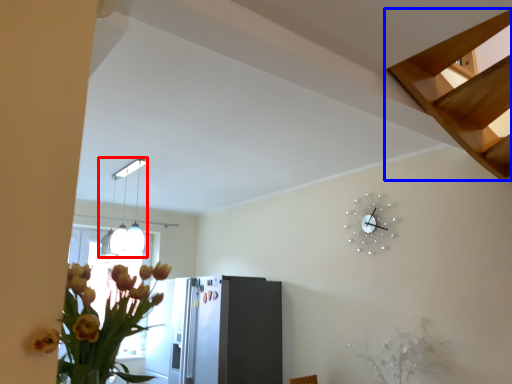
Question: Which object is closer to the camera taking this photo, lamp (highlighted by a red box) or stairs (highlighted by a blue box)?

Choices:
 (A) lamp
 (B) stairs

Answer: (B)